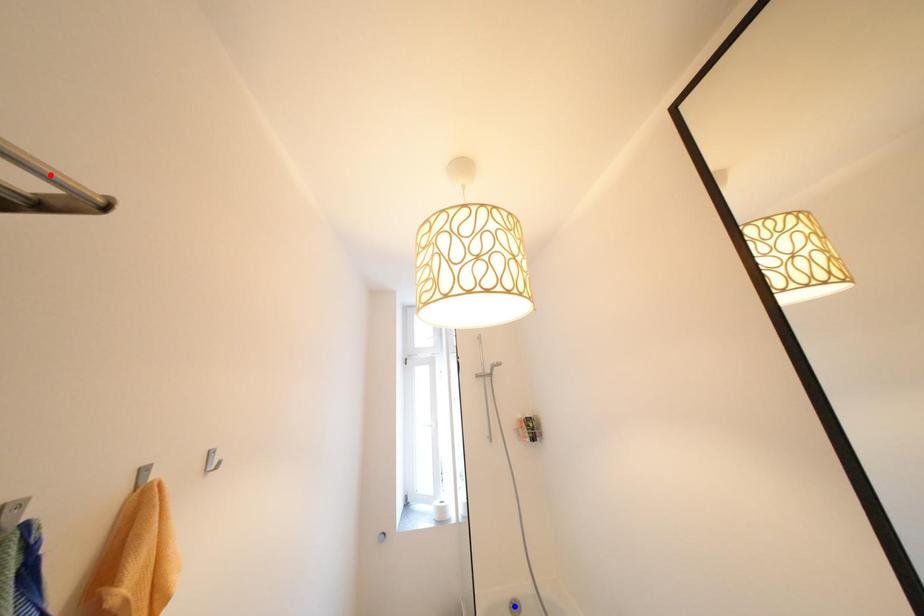
Question: Two points are marked on the image. Which point is closer to the camera?

Choices:
 (A) Blue point is closer.
 (B) Red point is closer.

Answer: (B)